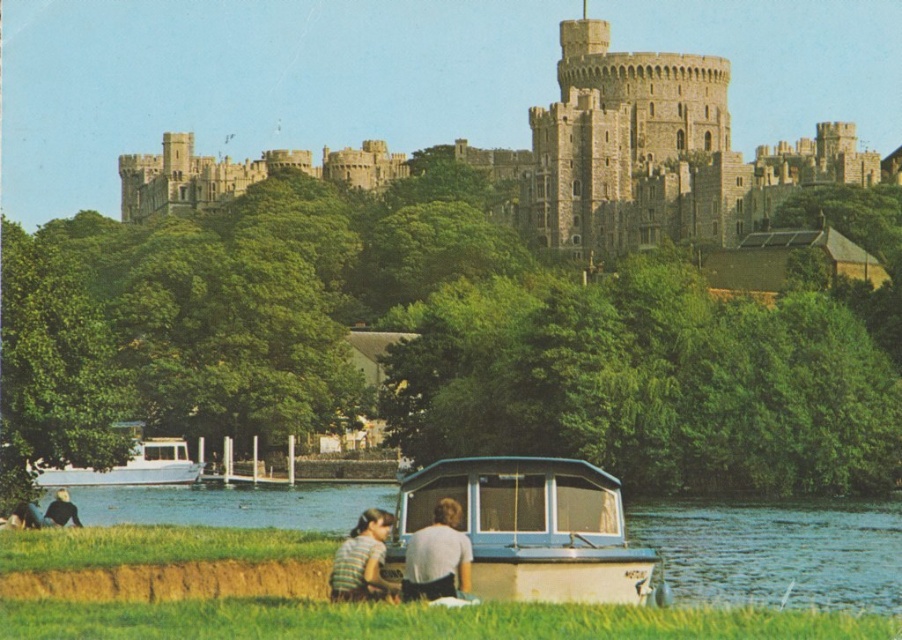
You are standing at the edge of the blue water at lower center and want to reach the white cotton shirt at lower center. In which direction should you move to get there?

You should move to the right because the white cotton shirt at lower center is positioned on the right side of the blue water at lower center.

You are standing at the base of the historic castle hill and see two people near the boat. One is wearing a striped cotton shirt at lower center and the other a dark brown leather jacket at lower left. Which person is closer to the water?

The striped cotton shirt at lower center is closer to the water because it is positioned below the dark brown leather jacket at lower left, indicating it is nearer to the foreground where the water is located.